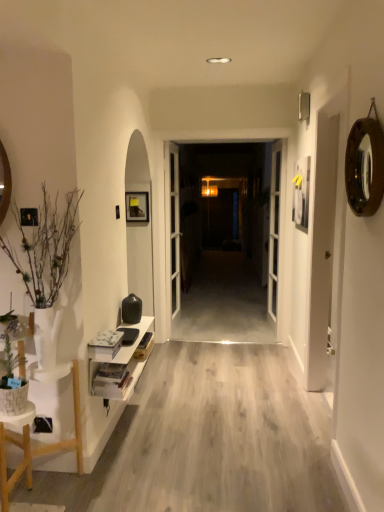
Where is `vacant space in transparent glass door at center (from a real-world perspective)`? This screenshot has height=512, width=384. vacant space in transparent glass door at center (from a real-world perspective) is located at coordinates (221, 314).